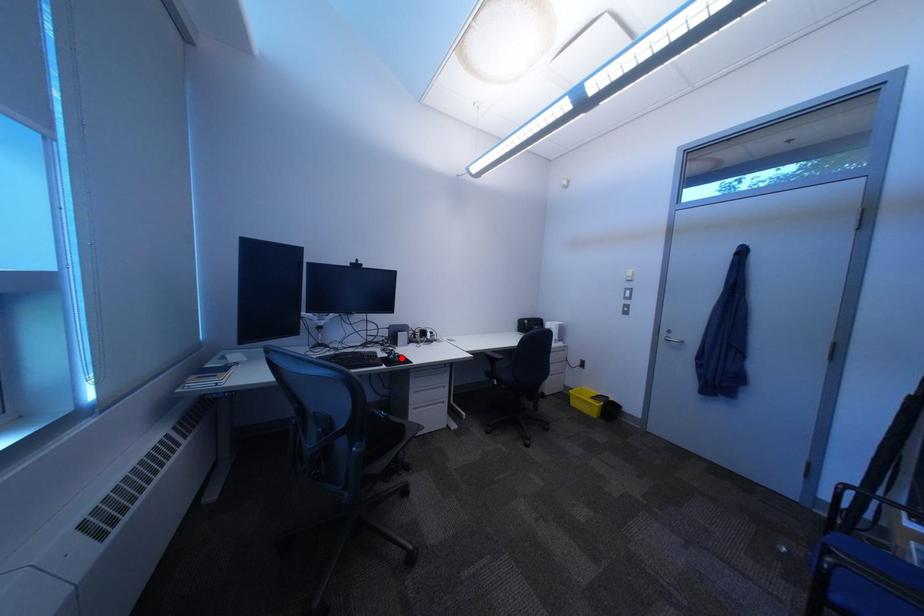
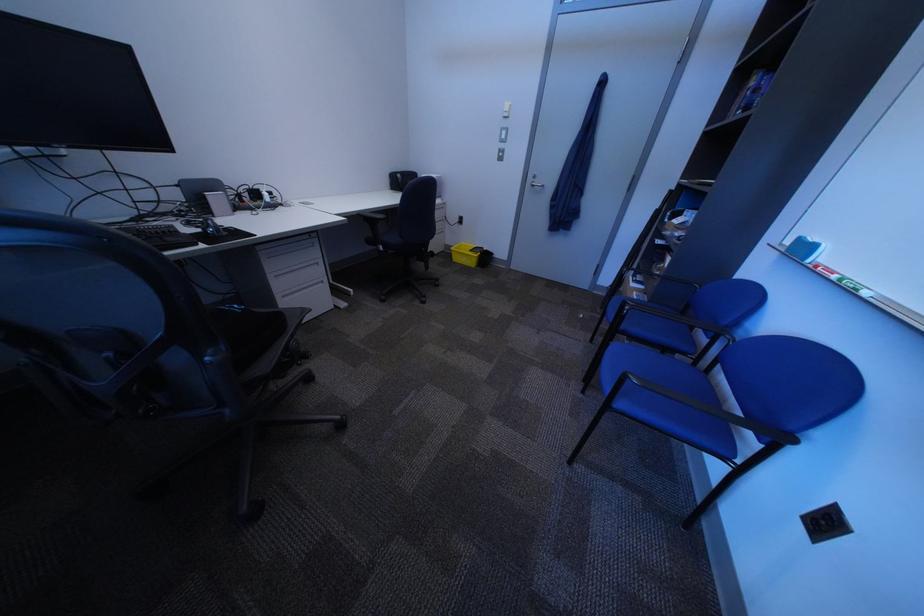
Question: I am providing you with two images of the same scene from different viewpoints. A red point is marked on the first image. Is the red point's position out of view in image 2?

Choices:
 (A) Yes
 (B) No

Answer: (B)